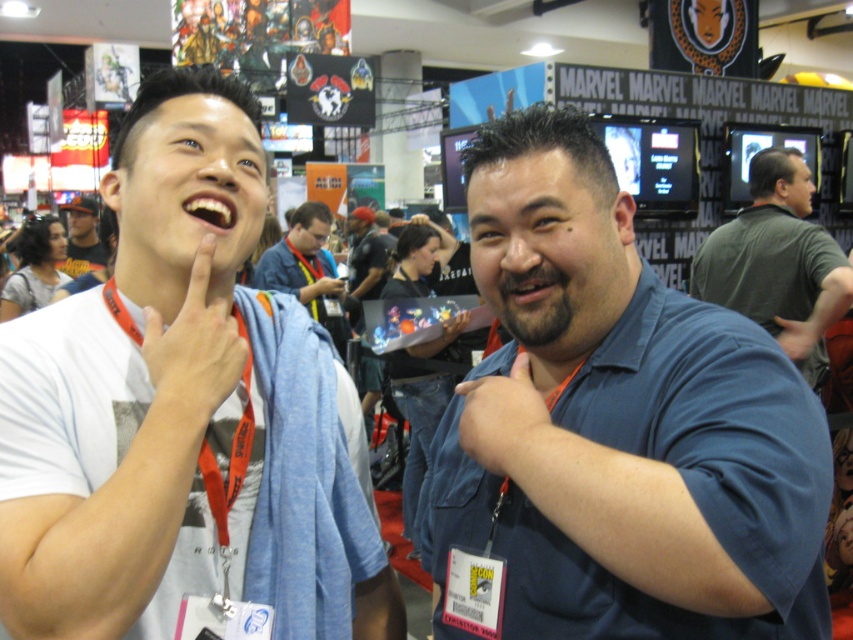
From the picture: Can you confirm if dark gray t-shirt at upper right is positioned to the right of blue fabric hand at center?

Indeed, dark gray t-shirt at upper right is positioned on the right side of blue fabric hand at center.

Is point (772, 260) positioned behind point (483, 424)?

That is True.

At what (x,y) coordinates should I click in order to perform the action: click on dark gray t-shirt at upper right. Please return your answer as a coordinate pair (x, y). The image size is (853, 640). Looking at the image, I should click on (776, 262).

Is dark blue shirt at center to the left of matte black hand at lower right from the viewer's perspective?

Yes, dark blue shirt at center is to the left of matte black hand at lower right.

Is point (386, 259) positioned after point (793, 332)?

Yes, it is.

This screenshot has height=640, width=853. In order to click on dark blue shirt at center in this screenshot , I will do `click(364, 256)`.

Which is above, blue cotton shirt at center or blue fabric hand at center?

blue fabric hand at center is above.

Which is more to the left, blue cotton shirt at center or blue fabric hand at center?

blue fabric hand at center

I want to click on blue cotton shirt at center, so click(x=618, y=426).

Where is `blue cotton shirt at center`? This screenshot has width=853, height=640. blue cotton shirt at center is located at coordinates (618, 426).